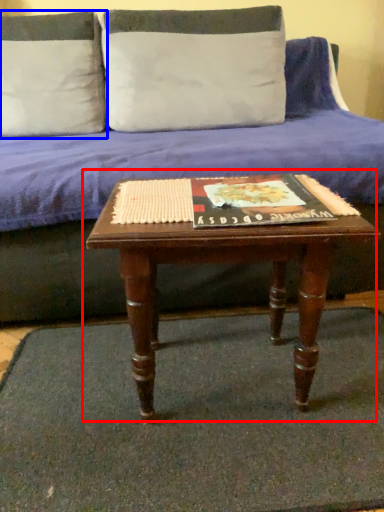
Question: Which point is further to the camera, coffee table (highlighted by a red box) or pillow (highlighted by a blue box)?

Choices:
 (A) coffee table
 (B) pillow

Answer: (B)